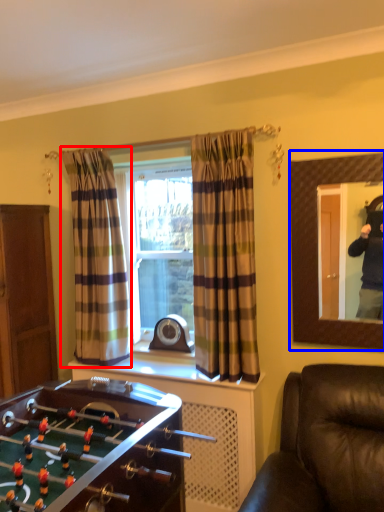
Question: Among these objects, which one is nearest to the camera, curtain (highlighted by a red box) or mirror (highlighted by a blue box)?

Choices:
 (A) curtain
 (B) mirror

Answer: (B)